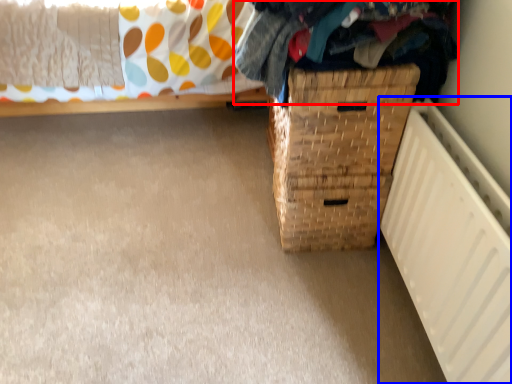
Question: Which object appears closest to the camera in this image, clothing (highlighted by a red box) or radiator (highlighted by a blue box)?

Choices:
 (A) clothing
 (B) radiator

Answer: (B)